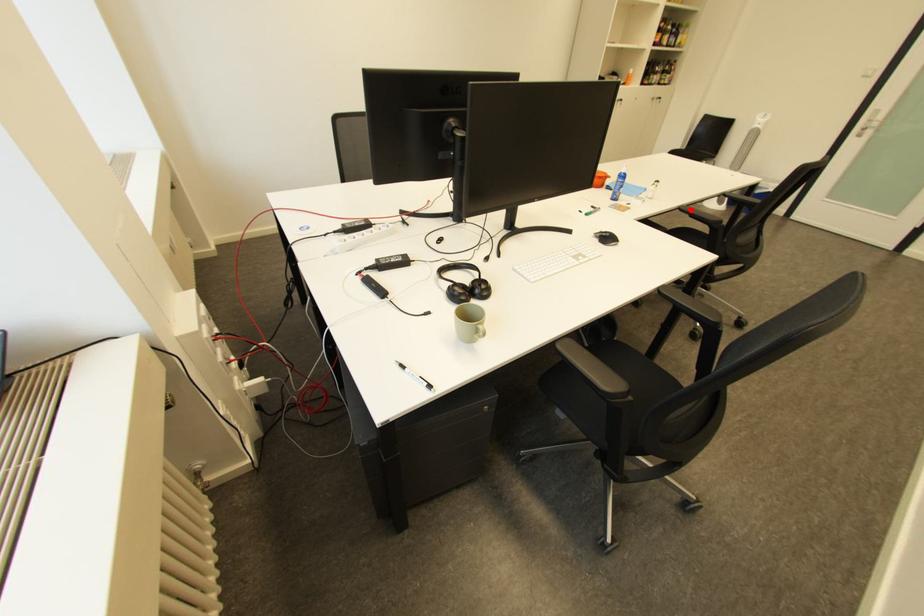
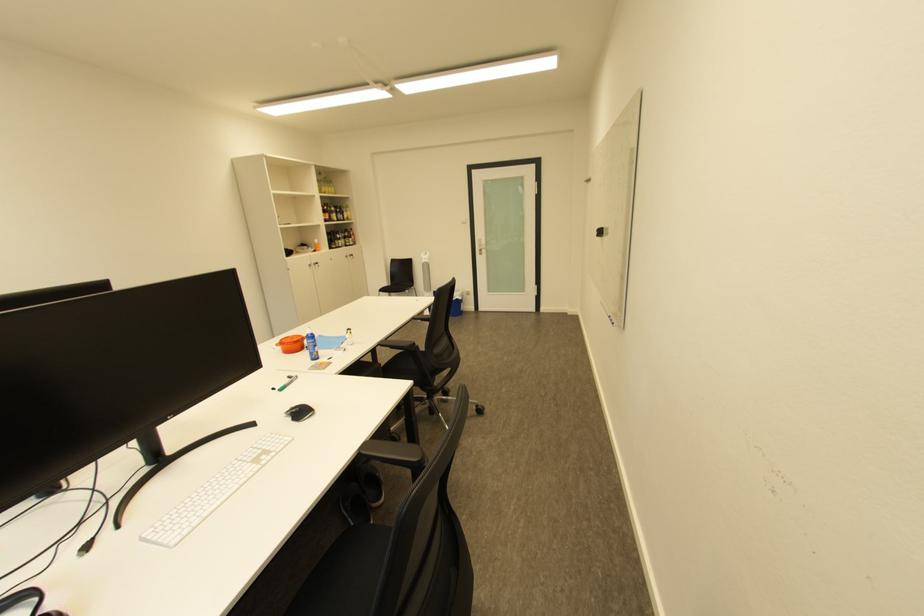
The point at the highlighted location is marked in the first image. Where is the corresponding point in the second image?

(391, 345)